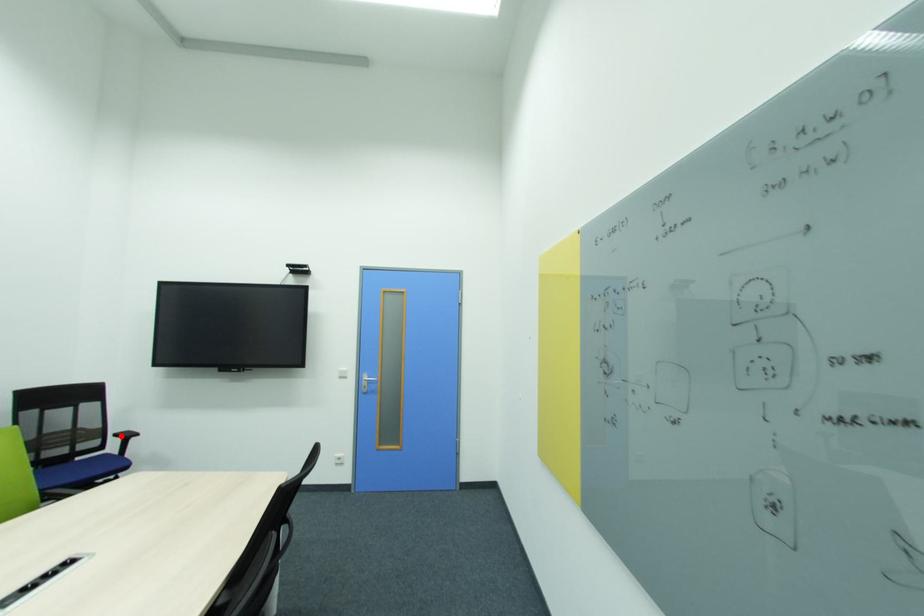
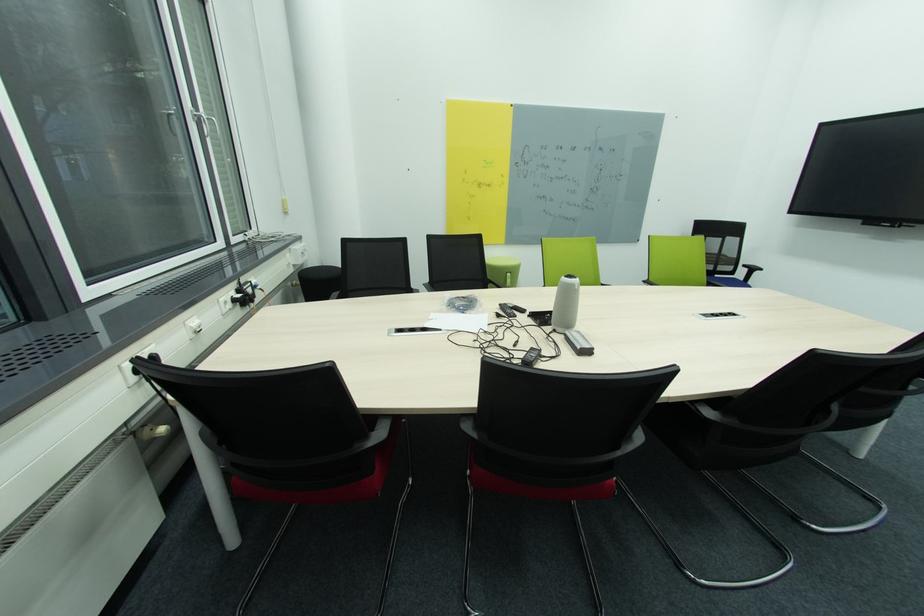
In the second image, find the point that corresponds to the highlighted location in the first image.

(749, 267)